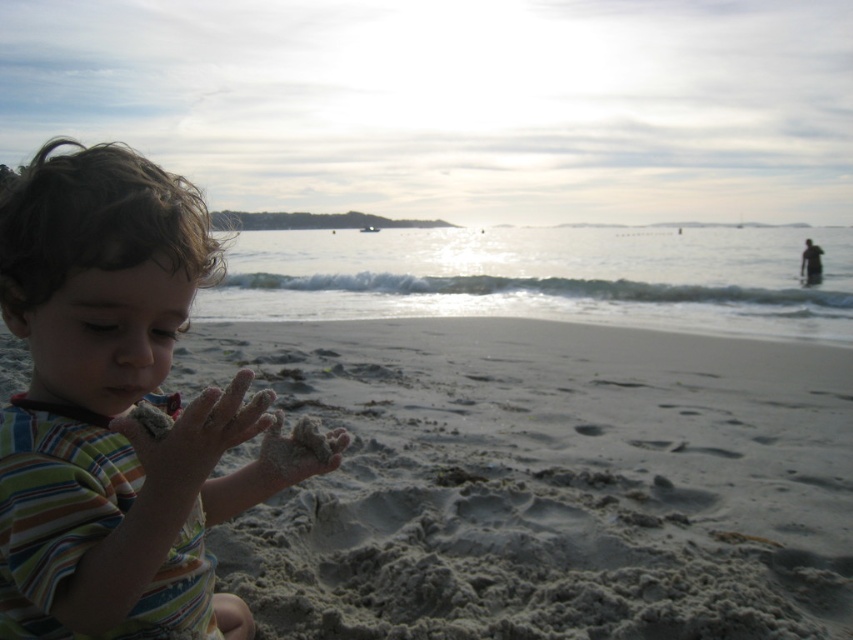
Can you confirm if fine-grained sand at lower center is positioned below sandy skin hand at lower left?

Yes, fine-grained sand at lower center is below sandy skin hand at lower left.

Does fine-grained sand at lower center have a greater height compared to sandy skin hand at lower left?

In fact, fine-grained sand at lower center may be shorter than sandy skin hand at lower left.

In the scene shown: Who is more forward, (x=393, y=428) or (x=221, y=435)?

Point (x=221, y=435) is more forward.

Find the location of a particular element. fine-grained sand at lower center is located at coordinates (544, 483).

Is striped cotton shirt at left in front of sandy skin hand at lower left?

No, striped cotton shirt at left is further to the viewer.

Can you confirm if striped cotton shirt at left is shorter than sandy skin hand at lower left?

No, striped cotton shirt at left is not shorter than sandy skin hand at lower left.

Who is more forward, (56, 275) or (158, 442)?

Point (158, 442)

You are a GUI agent. You are given a task and a screenshot of the screen. Output one action in this format:
    pyautogui.click(x=<x>, y=<y>)
    Task: Click on the striped cotton shirt at left
    This screenshot has height=640, width=853.
    Given the screenshot: What is the action you would take?
    pyautogui.click(x=111, y=406)

Can you confirm if fine-grained sand at lower center is positioned above striped cotton shirt at left?

Incorrect, fine-grained sand at lower center is not positioned above striped cotton shirt at left.

Does fine-grained sand at lower center appear on the left side of striped cotton shirt at left?

In fact, fine-grained sand at lower center is to the right of striped cotton shirt at left.

You are a GUI agent. You are given a task and a screenshot of the screen. Output one action in this format:
    pyautogui.click(x=<x>, y=<y>)
    Task: Click on the fine-grained sand at lower center
    This screenshot has height=640, width=853.
    Given the screenshot: What is the action you would take?
    pyautogui.click(x=544, y=483)